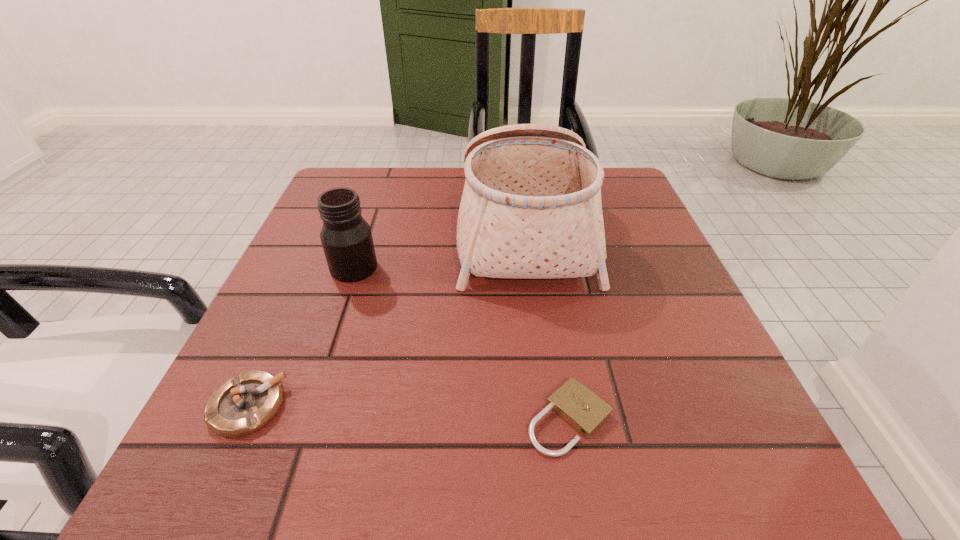
The height and width of the screenshot is (540, 960). In order to click on the tallest object in this screenshot , I will do `click(531, 208)`.

Locate an element on the screen. The image size is (960, 540). jar is located at coordinates (346, 237).

Find the location of a particular element. the second shortest object is located at coordinates (243, 405).

The width and height of the screenshot is (960, 540). Identify the location of padlock. (585, 411).

Locate an element on the screen. vacant space situated with the lid open on the basket is located at coordinates (421, 231).

I want to click on vacant space located with the lid open on the basket, so click(x=385, y=231).

Where is `free space located with the lid open on the basket`? This screenshot has height=540, width=960. free space located with the lid open on the basket is located at coordinates (357, 231).

Locate an element on the screen. free point located on the right of the third shortest object is located at coordinates (464, 268).

The width and height of the screenshot is (960, 540). I want to click on free location located on the right of the third tallest object, so click(x=487, y=406).

Locate an element on the screen. The height and width of the screenshot is (540, 960). free space located 0.180m on the left of the shortest object is located at coordinates (397, 418).